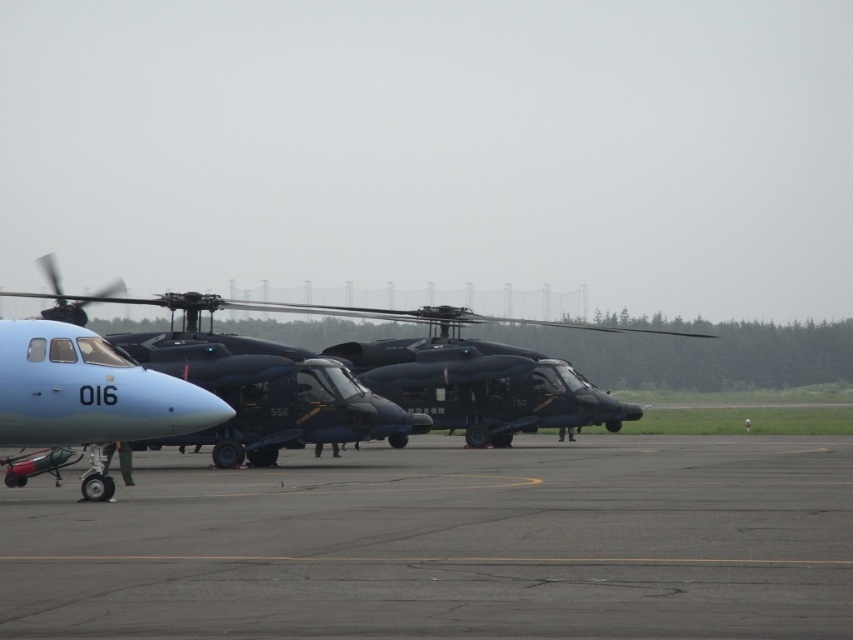
What are the coordinates of `gray asphalt tarmac at lower center` in the screenshot? It's located at (450, 545).

The width and height of the screenshot is (853, 640). What do you see at coordinates (450, 545) in the screenshot?
I see `gray asphalt tarmac at lower center` at bounding box center [450, 545].

Which is in front, point (506, 472) or point (212, 307)?

Point (506, 472) is more forward.

The height and width of the screenshot is (640, 853). What are the coordinates of `gray asphalt tarmac at lower center` in the screenshot? It's located at (450, 545).

Is gray asphalt tarmac at lower center shorter than matte blue airplane at lower left?

Indeed, gray asphalt tarmac at lower center has a lesser height compared to matte blue airplane at lower left.

Based on the photo, does gray asphalt tarmac at lower center have a larger size compared to matte blue airplane at lower left?

Correct, gray asphalt tarmac at lower center is larger in size than matte blue airplane at lower left.

Which is in front, point (671, 509) or point (161, 387)?

Positioned in front is point (671, 509).

I want to click on gray asphalt tarmac at lower center, so click(x=450, y=545).

Is matte blue airplane at lower left above matte black helicopter at center?

No, matte blue airplane at lower left is not above matte black helicopter at center.

Between point (77, 388) and point (265, 307), which one is positioned behind?

Positioned behind is point (265, 307).

In order to click on matte blue airplane at lower left in this screenshot , I will do tap(85, 400).